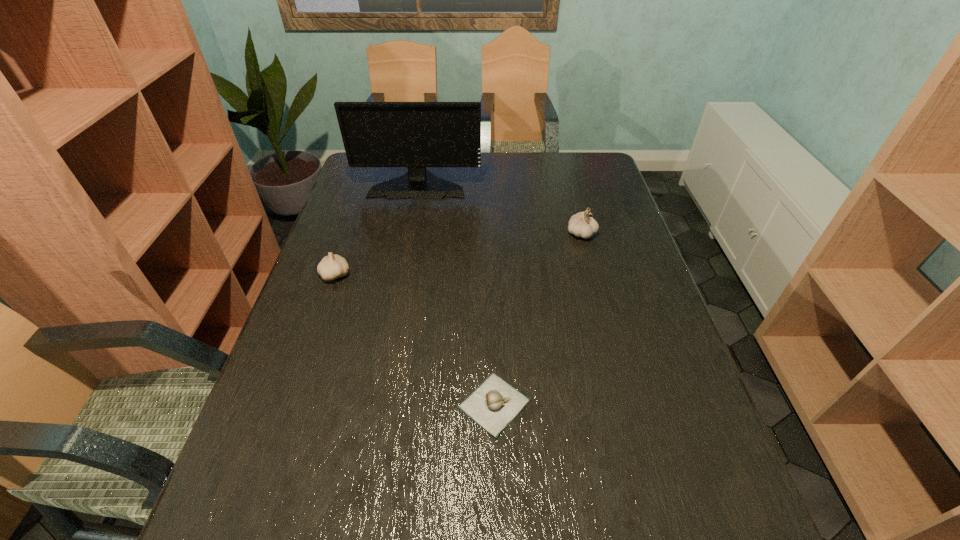
What are the coordinates of `vacant area that lies between the rightmost object and the nearest object` in the screenshot? It's located at (538, 319).

Locate which object ranks in proximity to the third tallest object. Please provide its 2D coordinates. Your answer should be formatted as a tuple, i.e. [(x, y)], where the tuple contains the x and y coordinates of a point satisfying the conditions above.

[(416, 135)]

Identify which object is the second closest to the second shortest garlic. Please provide its 2D coordinates. Your answer should be formatted as a tuple, i.e. [(x, y)], where the tuple contains the x and y coordinates of a point satisfying the conditions above.

[(493, 405)]

Locate an element on the screen. This screenshot has width=960, height=540. the third closest garlic relative to the farthest object is located at coordinates (493, 405).

Image resolution: width=960 pixels, height=540 pixels. What are the coordinates of `garlic that can be found as the closest to the rightmost object` in the screenshot? It's located at (493, 405).

This screenshot has height=540, width=960. In order to click on blank area in the image that satisfies the following two spatial constraints: 1. on the screen side of the rightmost garlic; 2. on the left side of the monitor in this screenshot , I will do `click(409, 233)`.

I want to click on blank space that satisfies the following two spatial constraints: 1. on the back side of the nearest garlic; 2. on the right side of the farthest garlic, so click(490, 233).

In order to click on free location that satisfies the following two spatial constraints: 1. on the screen side of the rightmost garlic; 2. on the left side of the tallest object in this screenshot , I will do pyautogui.click(x=409, y=233).

Identify the location of vacant area in the image that satisfies the following two spatial constraints: 1. on the screen side of the nearest garlic; 2. on the left side of the farthest object. The height and width of the screenshot is (540, 960). pyautogui.click(x=377, y=404).

Find the location of a particular element. vacant region that satisfies the following two spatial constraints: 1. on the screen side of the tallest object; 2. on the right side of the nearest garlic is located at coordinates (377, 404).